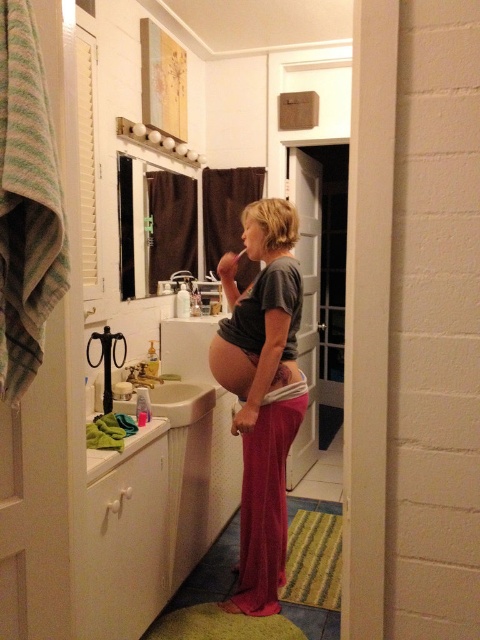
Between matte gray shirt at center and white glossy sink at lower left, which one is positioned higher?

white glossy sink at lower left is above.

Does matte gray shirt at center have a smaller size compared to white glossy sink at lower left?

No.

Is point (296, 304) less distant than point (170, 388)?

Yes, it is in front of point (170, 388).

The width and height of the screenshot is (480, 640). Identify the location of matte gray shirt at center. (263, 394).

Who is higher up, matte gray shirt at center or brushed metal faucet at sink left?

Positioned higher is brushed metal faucet at sink left.

Does point (260, 355) come behind point (130, 365)?

No.

Find the location of a particular element. matte gray shirt at center is located at coordinates (263, 394).

Who is positioned more to the left, white glossy sink at lower left or brushed metal faucet at sink left?

From the viewer's perspective, brushed metal faucet at sink left appears more on the left side.

Can you confirm if white glossy sink at lower left is positioned to the right of brushed metal faucet at sink left?

Yes, white glossy sink at lower left is to the right of brushed metal faucet at sink left.

I want to click on white glossy sink at lower left, so click(x=181, y=372).